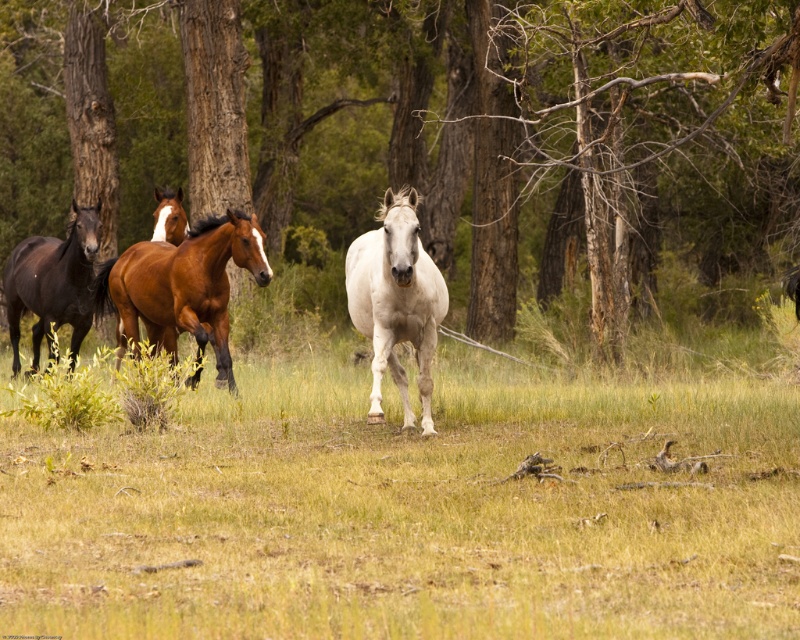
Question: Does brown wood tree at center have a lesser width compared to brown glossy horse at left?

Choices:
 (A) yes
 (B) no

Answer: (B)

Question: Can you confirm if yellow dry grass at center is smaller than shiny brown horse at center?

Choices:
 (A) yes
 (B) no

Answer: (B)

Question: Which of the following is the closest to the observer?

Choices:
 (A) (352, 292)
 (B) (34, 301)
 (C) (224, 355)
 (D) (202, 333)

Answer: (A)

Question: Which point is closer to the camera?

Choices:
 (A) brown wood tree at center
 (B) brown glossy horse at center

Answer: (A)

Question: Where is brown wood tree at center located in relation to white glossy horse at center in the image?

Choices:
 (A) left
 (B) right

Answer: (B)

Question: Among these points, which one is nearest to the camera?

Choices:
 (A) (166, 237)
 (B) (744, 600)
 (C) (406, 196)

Answer: (B)